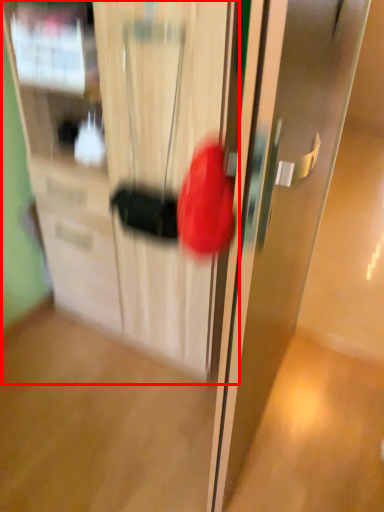
Question: From the image, what is the correct spatial relationship of cabinetry (annotated by the red box) in relation to door?

Choices:
 (A) left
 (B) right

Answer: (A)